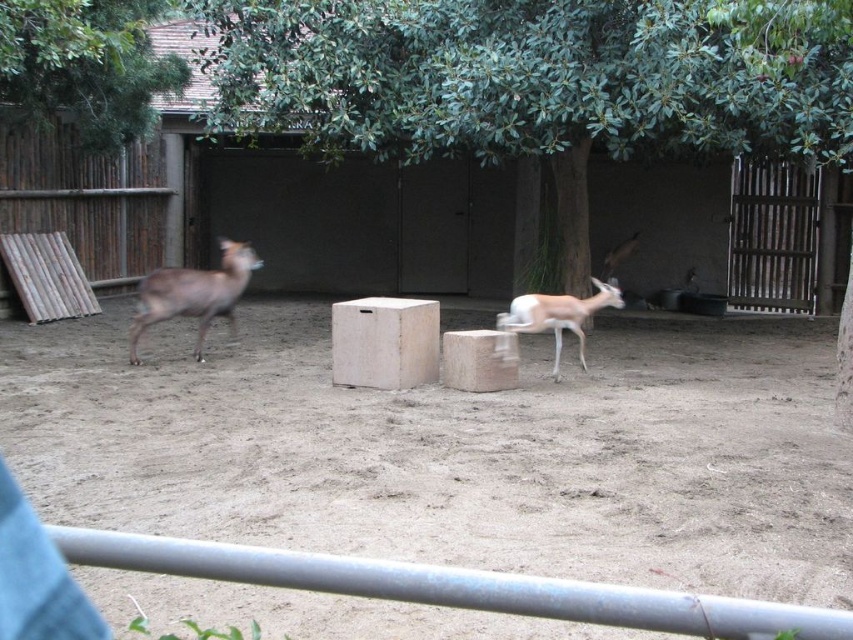
Question: Is green leafy tree at center closer to the viewer compared to brown wooden fence at left?

Choices:
 (A) no
 (B) yes

Answer: (B)

Question: Which of the following is the farthest from the observer?

Choices:
 (A) brown dirt field at center
 (B) green leafy tree at upper left
 (C) brown wooden gate at right

Answer: (C)

Question: Where is green leafy tree at upper left located in relation to light brown fur antelope at center in the image?

Choices:
 (A) right
 (B) left

Answer: (B)

Question: Is green leafy tree at upper left above light brown fur antelope at center?

Choices:
 (A) yes
 (B) no

Answer: (A)

Question: Which point is farther to the camera?

Choices:
 (A) (338, 326)
 (B) (9, 92)
 (C) (581, 308)
 (D) (640, 426)

Answer: (B)

Question: Which object appears closest to the camera in this image?

Choices:
 (A) light brown fur antelope at center
 (B) brown dirt field at center

Answer: (B)